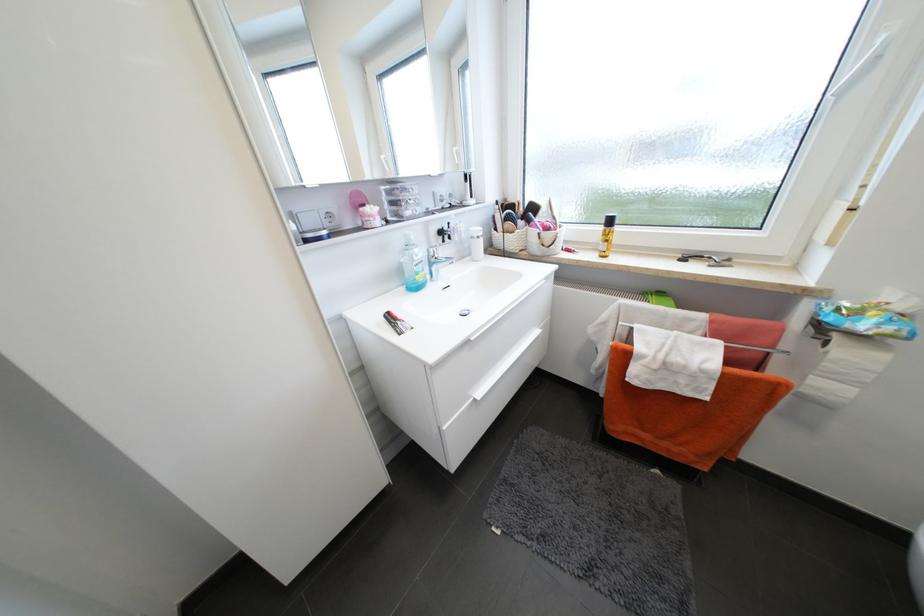
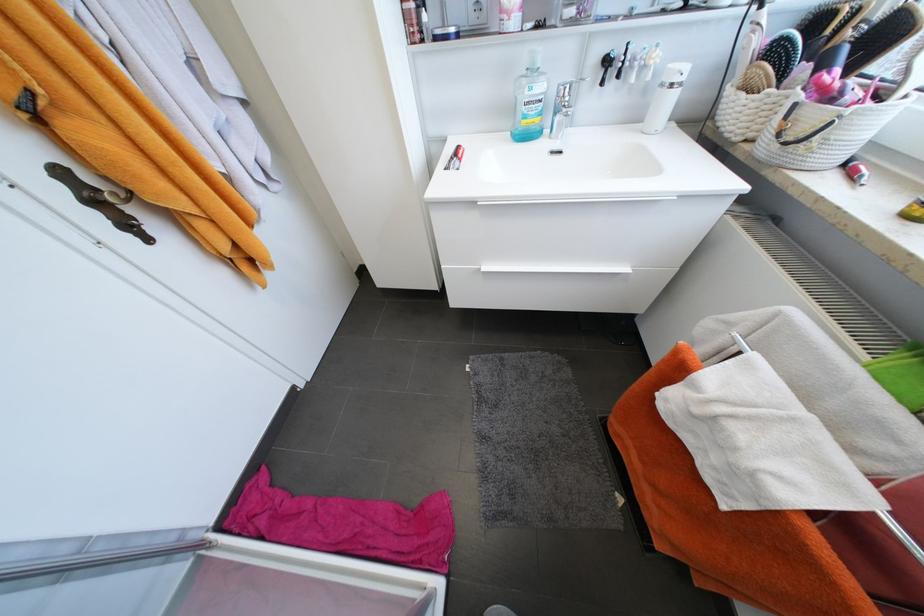
The point at (446, 233) is marked in the first image. Where is the corresponding point in the second image?

(613, 62)